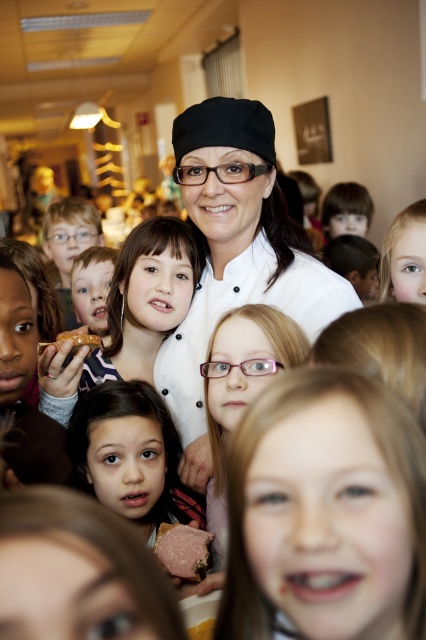
Question: Does smooth blonde hair at center appear on the right side of pink matte sandwich at center?

Choices:
 (A) no
 (B) yes

Answer: (B)

Question: Estimate the real-world distances between objects in this image. Which object is farther from the matte brown hair at center?

Choices:
 (A) brown bread at center
 (B) smooth blonde hair at center

Answer: (B)

Question: Can you confirm if smooth blonde hair at center is thinner than matte white shirt at center?

Choices:
 (A) no
 (B) yes

Answer: (B)

Question: Among these objects, which one is farthest from the camera?

Choices:
 (A) matte brown hair at center
 (B) matte white shirt at center
 (C) smooth blonde hair at center

Answer: (B)

Question: Is smooth blonde hair at center thinner than matte brown hair at center?

Choices:
 (A) yes
 (B) no

Answer: (A)

Question: Which of the following is the closest to the observer?

Choices:
 (A) (89, 476)
 (B) (183, 326)
 (C) (160, 547)

Answer: (C)